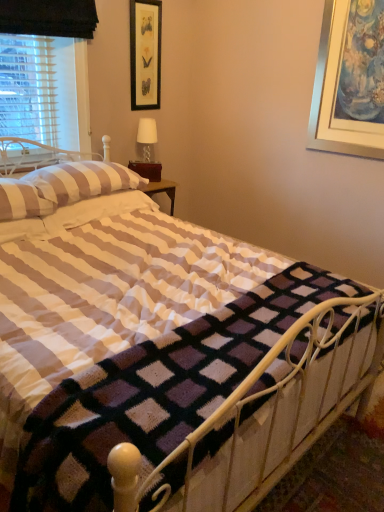
Question: Considering the relative sizes of white striped pillow at upper left, the 2th pillow positioned from the front, and white fabric lampshade at upper center in the image provided, is white striped pillow at upper left, the 2th pillow positioned from the front, wider than white fabric lampshade at upper center?

Choices:
 (A) yes
 (B) no

Answer: (A)

Question: Is white striped pillow at upper left, the first pillow viewed from the back, closer to the viewer compared to white fabric lampshade at upper center?

Choices:
 (A) no
 (B) yes

Answer: (B)

Question: Can white fabric lampshade at upper center be found inside white striped pillow at upper left, the 2th pillow positioned from the front?

Choices:
 (A) yes
 (B) no

Answer: (B)

Question: Does white striped pillow at upper left, the 2th pillow positioned from the front, appear on the right side of white fabric lampshade at upper center?

Choices:
 (A) no
 (B) yes

Answer: (A)

Question: Is white striped pillow at upper left, the 2th pillow positioned from the front, completely or partially outside of white fabric lampshade at upper center?

Choices:
 (A) yes
 (B) no

Answer: (A)

Question: Is white striped pillow at upper left, the 2th pillow positioned from the front, inside the boundaries of black framed picture at upper center, or outside?

Choices:
 (A) inside
 (B) outside

Answer: (B)

Question: Is white striped pillow at upper left, the 2th pillow positioned from the front, wider or thinner than black framed picture at upper center?

Choices:
 (A) wide
 (B) thin

Answer: (A)

Question: Is white striped pillow at upper left, the 2th pillow positioned from the front, bigger or smaller than black framed picture at upper center?

Choices:
 (A) big
 (B) small

Answer: (A)

Question: Is white striped pillow at upper left, the 2th pillow positioned from the front, taller or shorter than black framed picture at upper center?

Choices:
 (A) tall
 (B) short

Answer: (B)

Question: Looking at the image, does white striped pillow at upper left, positioned as the 1th pillow in front-to-back order, seem bigger or smaller compared to black framed picture at upper center?

Choices:
 (A) big
 (B) small

Answer: (A)

Question: Is white striped pillow at upper left, which is counted as the second pillow, starting from the back, in front of or behind black framed picture at upper center in the image?

Choices:
 (A) front
 (B) behind

Answer: (A)

Question: Visually, is white striped pillow at upper left, which is counted as the second pillow, starting from the back, positioned to the left or to the right of black framed picture at upper center?

Choices:
 (A) left
 (B) right

Answer: (A)

Question: Is point (19, 212) positioned closer to the camera than point (144, 80)?

Choices:
 (A) farther
 (B) closer

Answer: (B)

Question: Considering the positions of white fabric lampshade at upper center and white striped pillow at upper left, which is counted as the second pillow, starting from the back, in the image, is white fabric lampshade at upper center bigger or smaller than white striped pillow at upper left, which is counted as the second pillow, starting from the back,?

Choices:
 (A) big
 (B) small

Answer: (B)

Question: Is white fabric lampshade at upper center in front of or behind white striped pillow at upper left, which is counted as the second pillow, starting from the back, in the image?

Choices:
 (A) front
 (B) behind

Answer: (B)